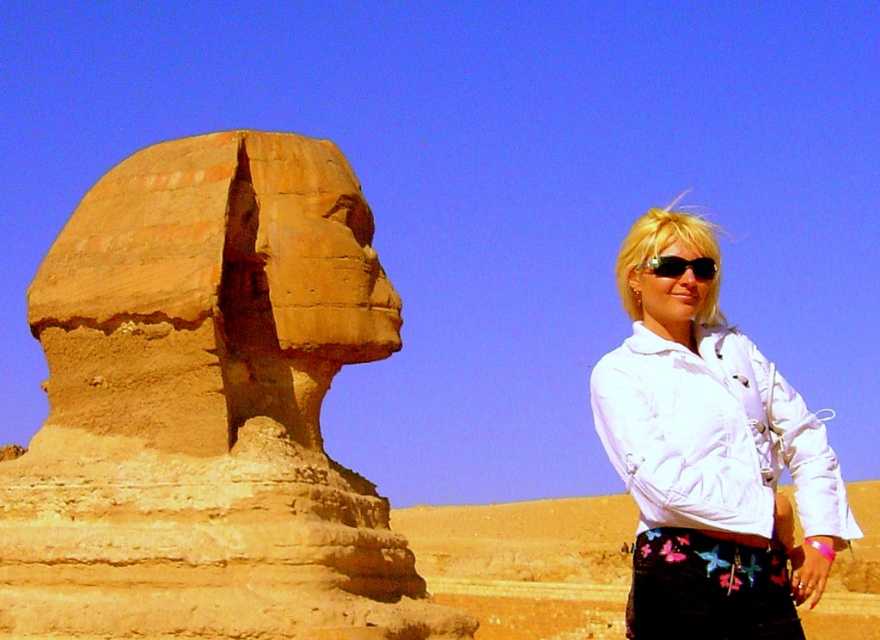
You are standing at the base of the Great Sphinx statue and see two points marked on the ground. The first point is labeled as point (666, 392) and the second is labeled as point (660, 276). Which point is closer to you if you are facing the Sphinx?

Point (666, 392) is in front of point (660, 276), so it is closer to you when facing the Sphinx.

You are standing at the base of the sandstone statue at left and want to take a photo of it with your phone. If your phone can capture a maximum distance of 150 feet in focus, will the statue be in focus?

The sandstone statue at left is 171.55 feet away from viewer, which exceeds the phone camera maximum focus distance of 150 feet. The statue will be out of focus.

You are a tourist standing in front of the Great Sphinx of Giza. You notice a person wearing a white matte jacket at right and black plastic sunglasses at upper right. Which item is positioned higher in the image?

The black plastic sunglasses at upper right are positioned higher than the white matte jacket at right.